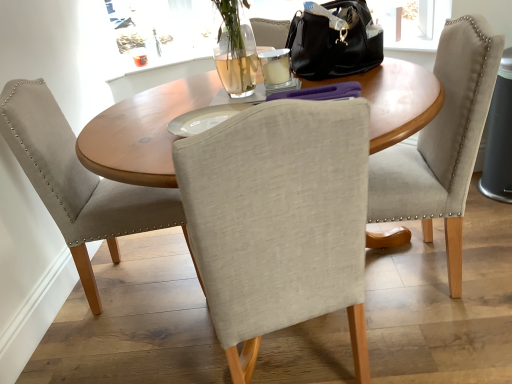
The height and width of the screenshot is (384, 512). What are the coordinates of `vacant area that is in front of light gray fabric chair at left, the 2th chair positioned from the right` in the screenshot? It's located at (132, 340).